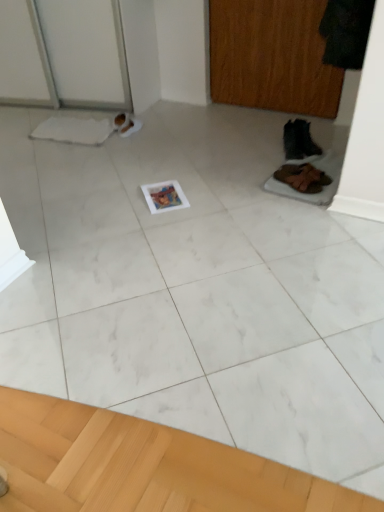
Question: From the image's perspective, is brown suede shoes at lower right, the second footwear viewed from the back, above wooden screen door at upper right?

Choices:
 (A) yes
 (B) no

Answer: (B)

Question: Is brown suede shoes at lower right, the second footwear viewed from the back, smaller than wooden screen door at upper right?

Choices:
 (A) yes
 (B) no

Answer: (A)

Question: Is wooden screen door at upper right at the back of brown suede shoes at lower right, which appears as the second footwear when viewed from the top?

Choices:
 (A) yes
 (B) no

Answer: (B)

Question: Does brown suede shoes at lower right, placed as the first footwear when sorted from bottom to top, come in front of wooden screen door at upper right?

Choices:
 (A) yes
 (B) no

Answer: (A)

Question: Does brown suede shoes at lower right, which appears as the second footwear when viewed from the top, appear on the right side of wooden screen door at upper right?

Choices:
 (A) yes
 (B) no

Answer: (A)

Question: Can you confirm if brown suede shoes at lower right, the second footwear viewed from the back, is taller than wooden screen door at upper right?

Choices:
 (A) yes
 (B) no

Answer: (B)

Question: Can you confirm if brown suede shoes at lower right, placed as the first footwear when sorted from bottom to top, is thinner than black leather boot at right, marked as the 2th footwear in a front-to-back arrangement?

Choices:
 (A) no
 (B) yes

Answer: (A)

Question: Is the position of brown suede shoes at lower right, the second footwear viewed from the back, less distant than that of black leather boot at right, the second footwear when ordered from bottom to top?

Choices:
 (A) yes
 (B) no

Answer: (A)

Question: From a real-world perspective, does brown suede shoes at lower right, which appears as the second footwear when viewed from the top, stand above black leather boot at right, the 1th footwear viewed from the top?

Choices:
 (A) yes
 (B) no

Answer: (B)

Question: Is brown suede shoes at lower right, placed as the first footwear when sorted from bottom to top, behind black leather boot at right, marked as the 2th footwear in a front-to-back arrangement?

Choices:
 (A) no
 (B) yes

Answer: (A)

Question: From the image's perspective, is brown suede shoes at lower right, which appears as the second footwear when viewed from the top, beneath black leather boot at right, the first footwear in the back-to-front sequence?

Choices:
 (A) no
 (B) yes

Answer: (B)

Question: Is brown suede shoes at lower right, which appears as the second footwear when viewed from the top, completely or partially outside of black leather boot at right, the 1th footwear viewed from the top?

Choices:
 (A) no
 (B) yes

Answer: (B)

Question: Is wooden screen door at upper right smaller than black leather boot at right, the 1th footwear viewed from the top?

Choices:
 (A) yes
 (B) no

Answer: (B)